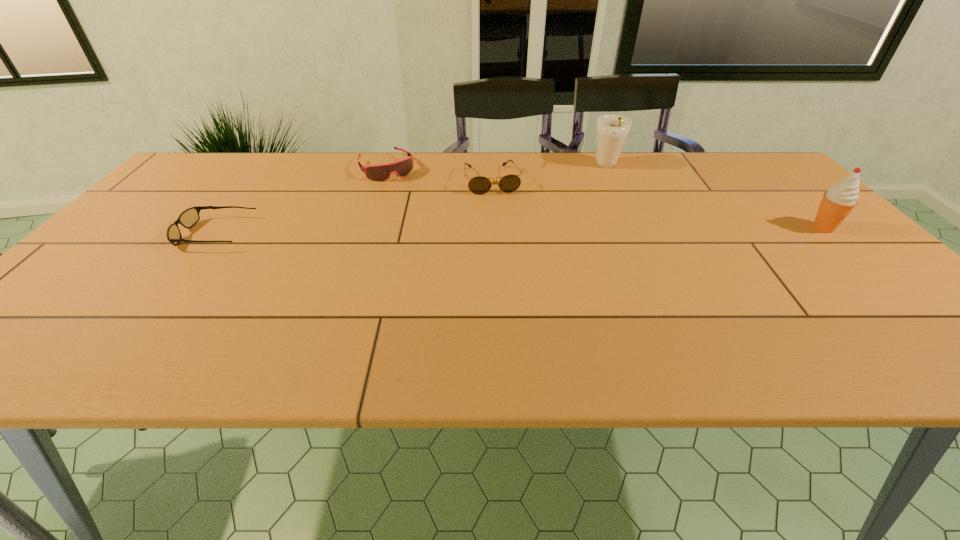
Locate an element on the screen. vacant space on the desktop that is between the shortest object and the icecream and is positioned on the lenses of the third object from right to left is located at coordinates (508, 231).

You are a GUI agent. You are given a task and a screenshot of the screen. Output one action in this format:
    pyautogui.click(x=<x>, y=<y>)
    Task: Click on the vacant space on the desktop that is between the shorter sunglasses and the icecream and is positioned on the drink side of the root beer
    This screenshot has width=960, height=540.
    Given the screenshot: What is the action you would take?
    pyautogui.click(x=586, y=230)

The height and width of the screenshot is (540, 960). In order to click on vacant space on the desktop that is between the left sunglasses and the rightmost object and is positioned on the front-facing side of the goggles in this screenshot , I will do `click(431, 232)`.